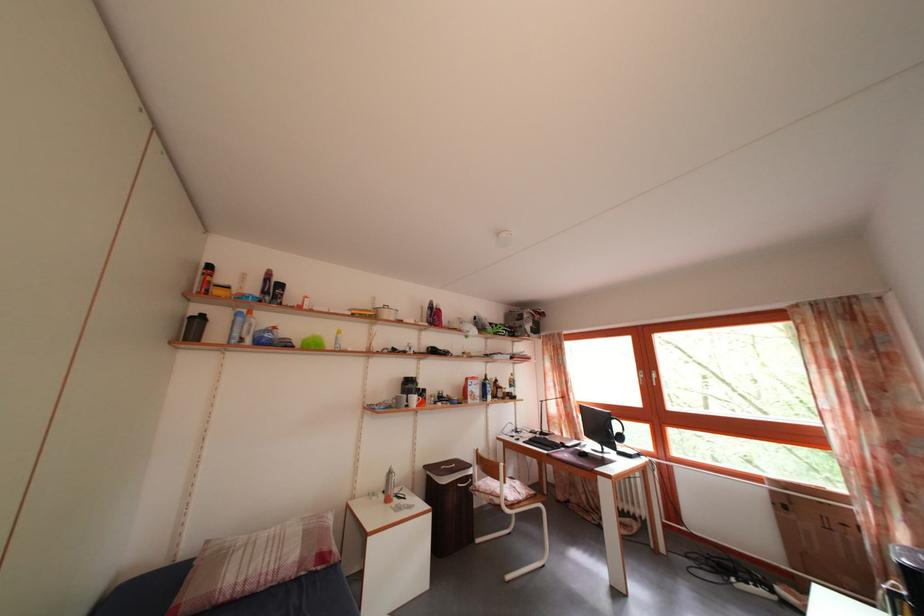
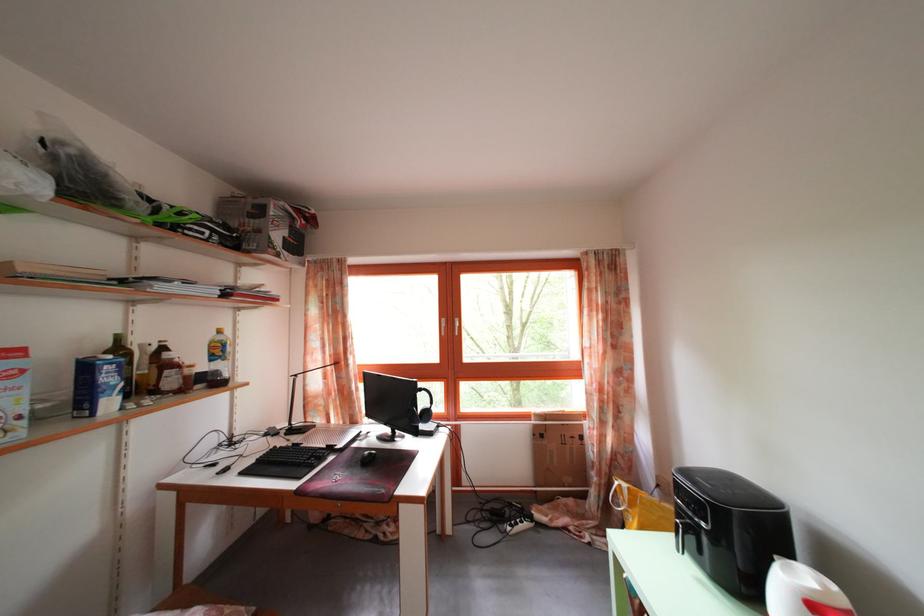
Locate, in the second image, the point that corresponds to point (781, 500) in the first image.

(542, 432)